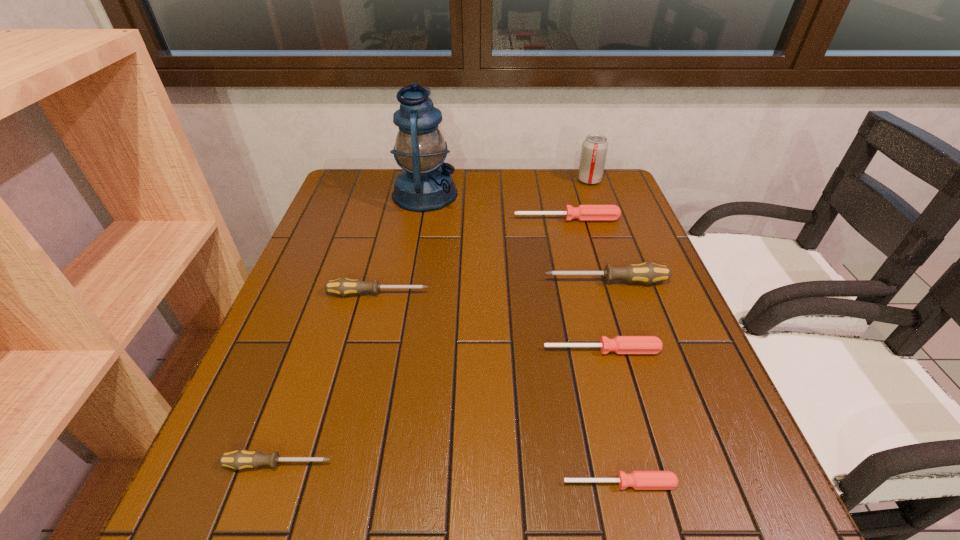
Locate an element on the screen. The height and width of the screenshot is (540, 960). free spot that satisfies the following two spatial constraints: 1. on the back side of the seventh shortest object; 2. on the right side of the sixth farthest object is located at coordinates (558, 180).